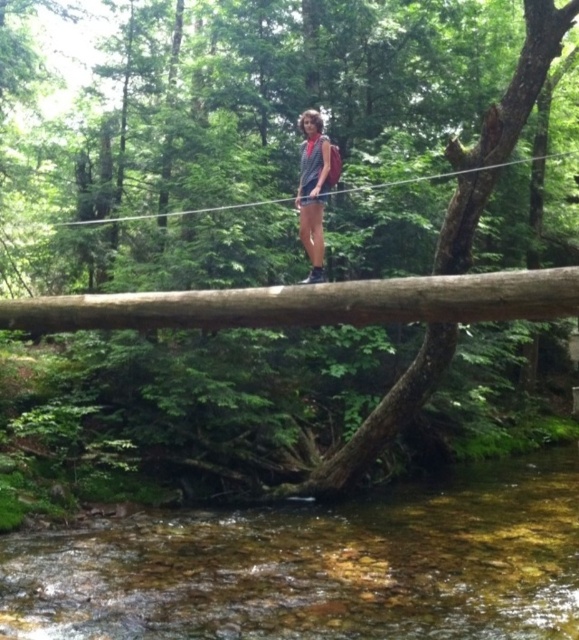
Question: Estimate the real-world distances between objects in this image. Which object is closer to the clear water at center?

Choices:
 (A) gray fabric shirt at center
 (B) brown rough log at center

Answer: (B)

Question: Does clear water at center have a greater width compared to gray fabric shirt at center?

Choices:
 (A) yes
 (B) no

Answer: (A)

Question: Observing the image, what is the correct spatial positioning of clear water at center in reference to gray fabric shirt at center?

Choices:
 (A) right
 (B) left

Answer: (A)

Question: Which object is the farthest from the clear water at center?

Choices:
 (A) brown rough log at center
 (B) gray fabric shirt at center

Answer: (B)

Question: Can you confirm if clear water at center is positioned to the right of gray fabric shirt at center?

Choices:
 (A) yes
 (B) no

Answer: (A)

Question: Which object is closer to the camera taking this photo?

Choices:
 (A) brown rough log at center
 (B) clear water at center

Answer: (A)